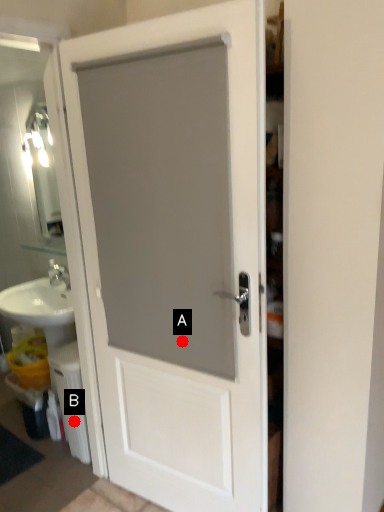
Question: Two points are circled on the image, labeled by A and B beside each circle. Which point is farther to the camera?

Choices:
 (A) A is further
 (B) B is further

Answer: (B)